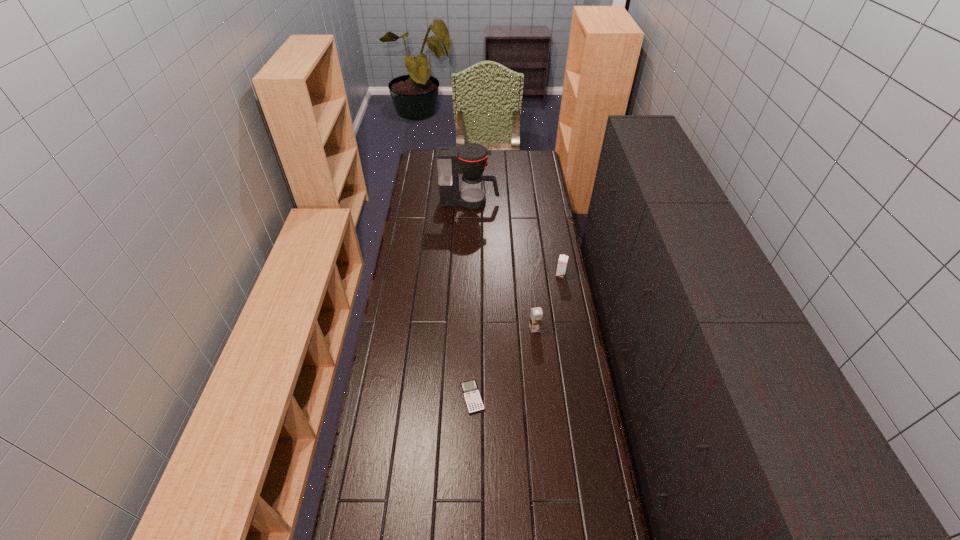
In order to click on free point located on the back of the right chocolate milk in this screenshot , I will do `click(558, 258)`.

At what (x,y) coordinates should I click in order to perform the action: click on vacant space located 0.250m on the right of the calculator. Please return your answer as a coordinate pair (x, y). This screenshot has width=960, height=540. Looking at the image, I should click on (557, 397).

This screenshot has height=540, width=960. Find the location of `vacant area at the far edge of the desktop`. vacant area at the far edge of the desktop is located at coordinates (492, 161).

The height and width of the screenshot is (540, 960). Find the location of `vacant space at the left edge of the desktop`. vacant space at the left edge of the desktop is located at coordinates (394, 449).

At what (x,y) coordinates should I click in order to perform the action: click on free space at the right edge of the desktop. Please return your answer as a coordinate pair (x, y). Image resolution: width=960 pixels, height=540 pixels. Looking at the image, I should click on (549, 259).

In order to click on vacant area that lies between the rightmost object and the nearer chocolate milk in this screenshot , I will do `click(547, 302)`.

Where is `free space between the calculator and the farthest object`? Image resolution: width=960 pixels, height=540 pixels. free space between the calculator and the farthest object is located at coordinates (471, 300).

Locate an element on the screen. free spot between the shortest object and the coffee maker is located at coordinates (471, 300).

The height and width of the screenshot is (540, 960). Find the location of `empty space between the calculator and the tallest object`. empty space between the calculator and the tallest object is located at coordinates (471, 300).

Locate an element on the screen. The image size is (960, 540). vacant region between the calculator and the left chocolate milk is located at coordinates (503, 363).